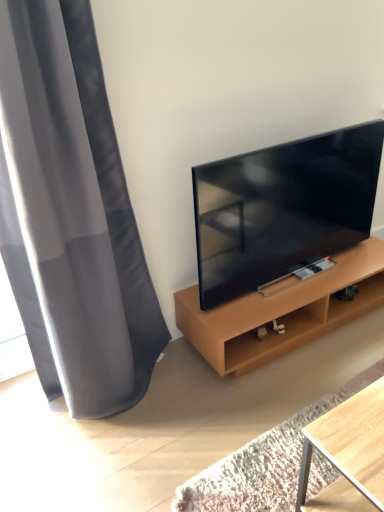
The width and height of the screenshot is (384, 512). I want to click on blank space above wooden shelf at right (from a real-world perspective), so click(x=305, y=276).